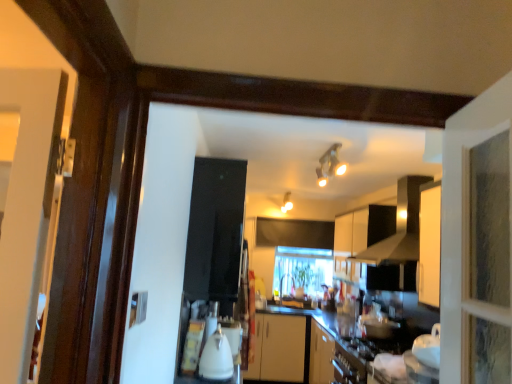
Question: Is matte white light fixture at upper center, the first light fixture in the left-to-right sequence, to the left of black matte exhaust hood at upper center from the viewer's perspective?

Choices:
 (A) no
 (B) yes

Answer: (B)

Question: Can you confirm if matte white light fixture at upper center, the first light fixture in the left-to-right sequence, is shorter than black matte exhaust hood at upper center?

Choices:
 (A) no
 (B) yes

Answer: (B)

Question: From the image's perspective, is matte white light fixture at upper center, acting as the 2th light fixture starting from the right, under black matte exhaust hood at upper center?

Choices:
 (A) yes
 (B) no

Answer: (B)

Question: Considering the relative sizes of matte white light fixture at upper center, acting as the 2th light fixture starting from the right, and black matte exhaust hood at upper center in the image provided, is matte white light fixture at upper center, acting as the 2th light fixture starting from the right, smaller than black matte exhaust hood at upper center?

Choices:
 (A) no
 (B) yes

Answer: (B)

Question: Is the depth of matte white light fixture at upper center, the 1th light fixture in the back-to-front sequence, greater than that of black matte exhaust hood at upper center?

Choices:
 (A) yes
 (B) no

Answer: (A)

Question: In terms of width, does matte white light fixture at upper center, arranged as the second light fixture when viewed from the front, look wider or thinner when compared to white matte cabinet at upper center?

Choices:
 (A) wide
 (B) thin

Answer: (A)

Question: Is matte white light fixture at upper center, acting as the second light fixture starting from the top, taller or shorter than white matte cabinet at upper center?

Choices:
 (A) short
 (B) tall

Answer: (A)

Question: From the image's perspective, is matte white light fixture at upper center, the first light fixture in the left-to-right sequence, positioned above or below white matte cabinet at upper center?

Choices:
 (A) above
 (B) below

Answer: (A)

Question: Is matte white light fixture at upper center, the first light fixture in the left-to-right sequence, in front of or behind white matte cabinet at upper center in the image?

Choices:
 (A) behind
 (B) front

Answer: (A)

Question: Is point (367, 230) closer or farther from the camera than point (222, 350)?

Choices:
 (A) farther
 (B) closer

Answer: (A)

Question: In terms of width, does white matte cabinet at upper center look wider or thinner when compared to white glossy kettle at center?

Choices:
 (A) wide
 (B) thin

Answer: (A)

Question: Is white matte cabinet at upper center to the left or to the right of white glossy kettle at center in the image?

Choices:
 (A) left
 (B) right

Answer: (B)

Question: From a real-world perspective, relative to white glossy kettle at center, is white matte cabinet at upper center vertically above or below?

Choices:
 (A) below
 (B) above

Answer: (B)

Question: Is white glossy kettle at center bigger or smaller than clear glass window at center?

Choices:
 (A) small
 (B) big

Answer: (A)

Question: Considering their positions, is white glossy kettle at center located in front of or behind clear glass window at center?

Choices:
 (A) front
 (B) behind

Answer: (A)